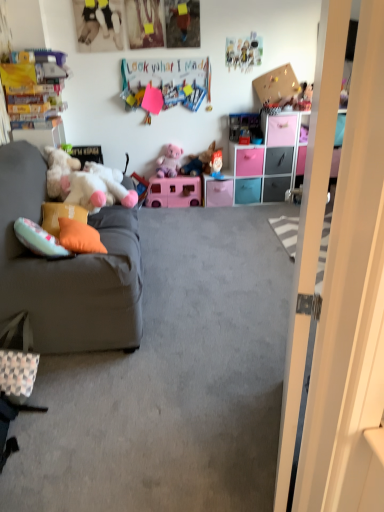
You are a GUI agent. You are given a task and a screenshot of the screen. Output one action in this format:
    pyautogui.click(x=<x>, y=<y>)
    Task: Click on the vacant area that lies between white glossy door at right and teal plastic drawer at center, the 4th drawer when ordered from right to left
    This screenshot has width=384, height=512.
    Given the screenshot: What is the action you would take?
    pyautogui.click(x=252, y=291)